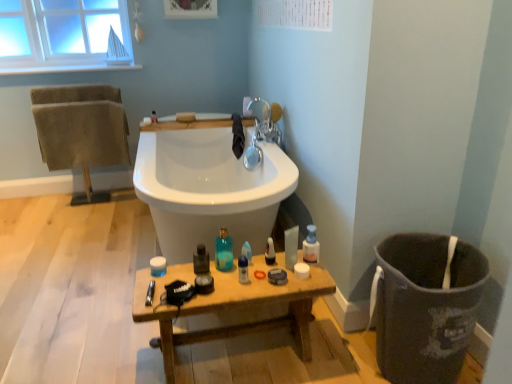
Locate an element on the screen. The height and width of the screenshot is (384, 512). vacant area that is in front of blue glossy bottle at center, which is the 1th mouthwash in right-to-left order is located at coordinates (241, 289).